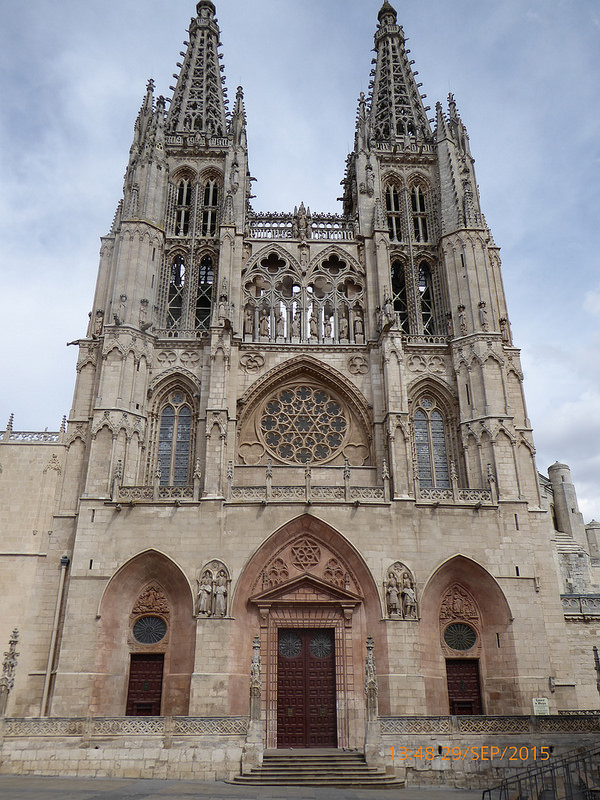
This screenshot has height=800, width=600. What are the coordinates of `brick wall` in the screenshot? It's located at (143, 753), (450, 772).